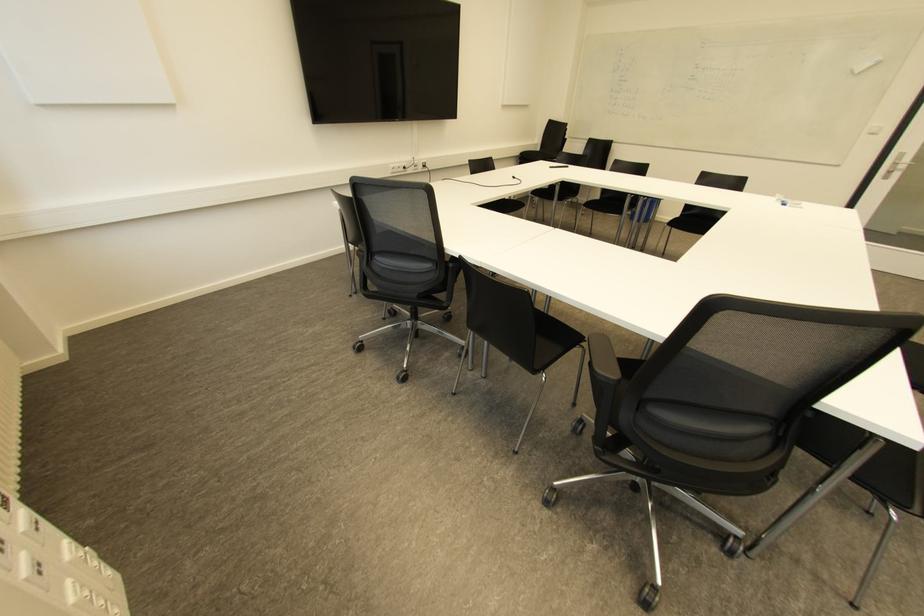
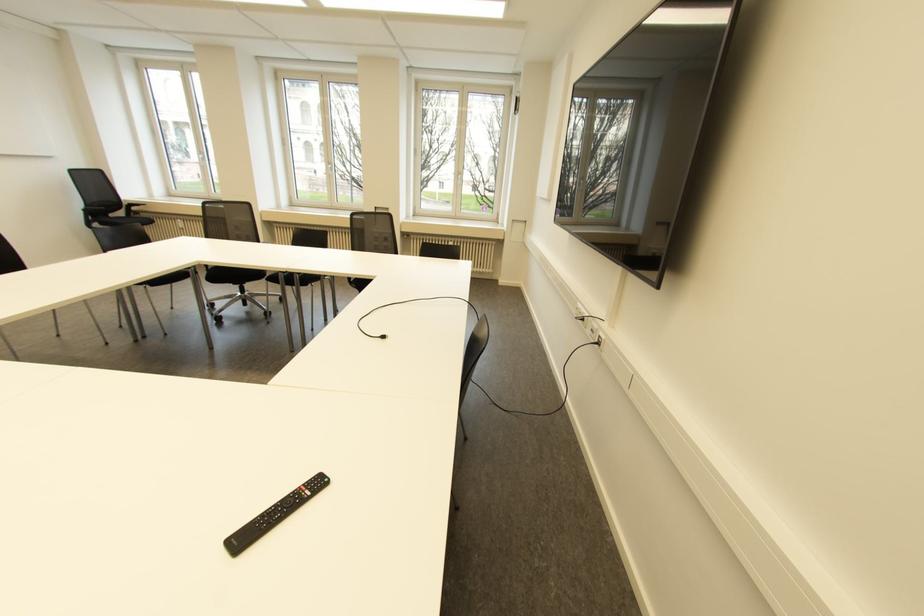
Find the pixel in the second image that matches pixel 423 166 in the first image.

(598, 342)